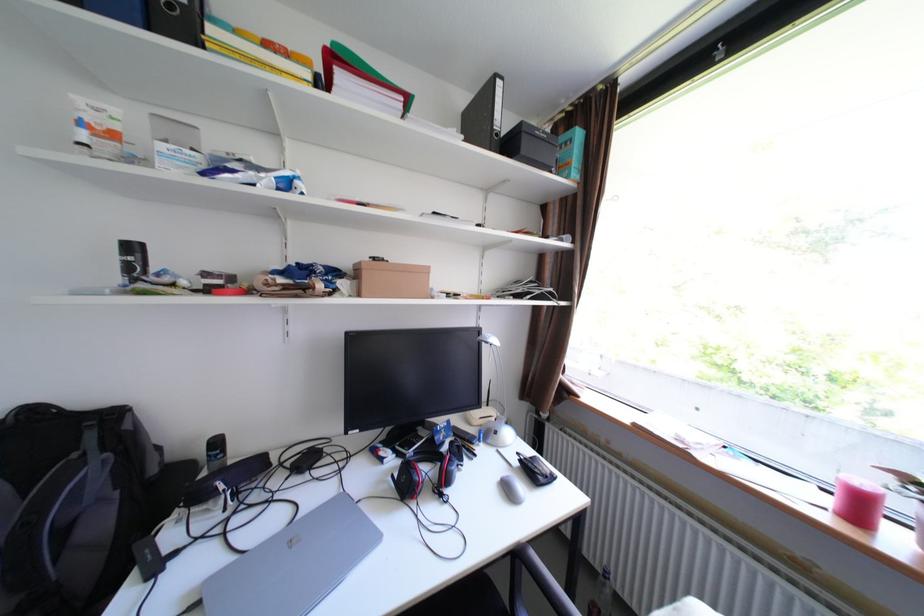
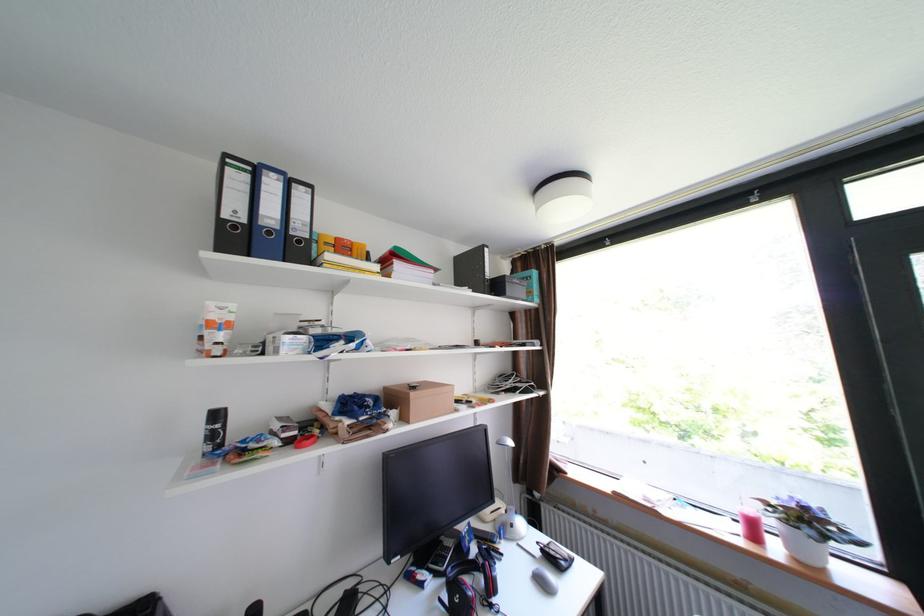
Question: The first image is from the beginning of the video and the second image is from the end. How did the camera likely rotate when shooting the video?

Choices:
 (A) Left
 (B) Right
 (C) Up
 (D) Down

Answer: (B)